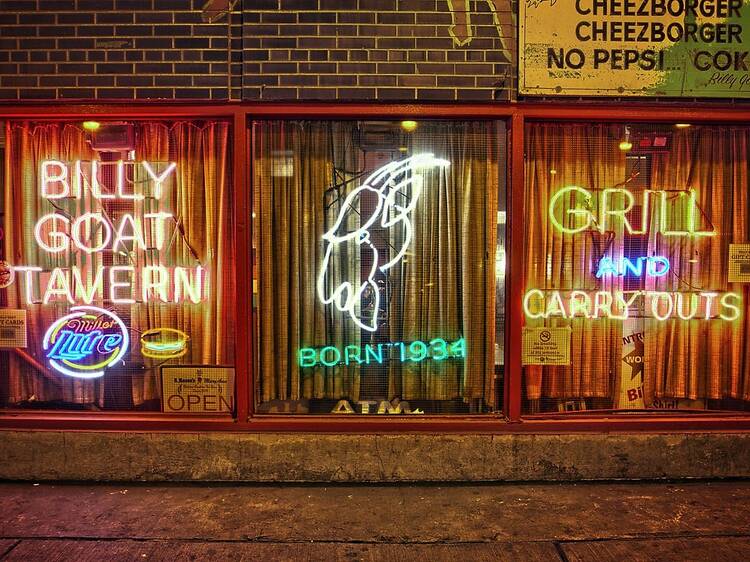
This screenshot has height=562, width=750. In order to click on brick ledge in this screenshot , I will do `click(415, 466)`.